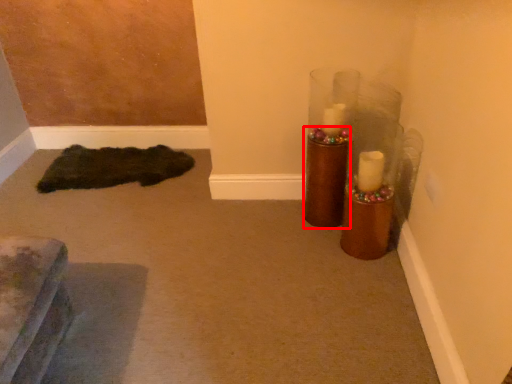
Question: Considering the relative positions of candle holder (annotated by the red box) and doormat in the image provided, where is candle holder (annotated by the red box) located with respect to the staircase?

Choices:
 (A) left
 (B) right

Answer: (B)